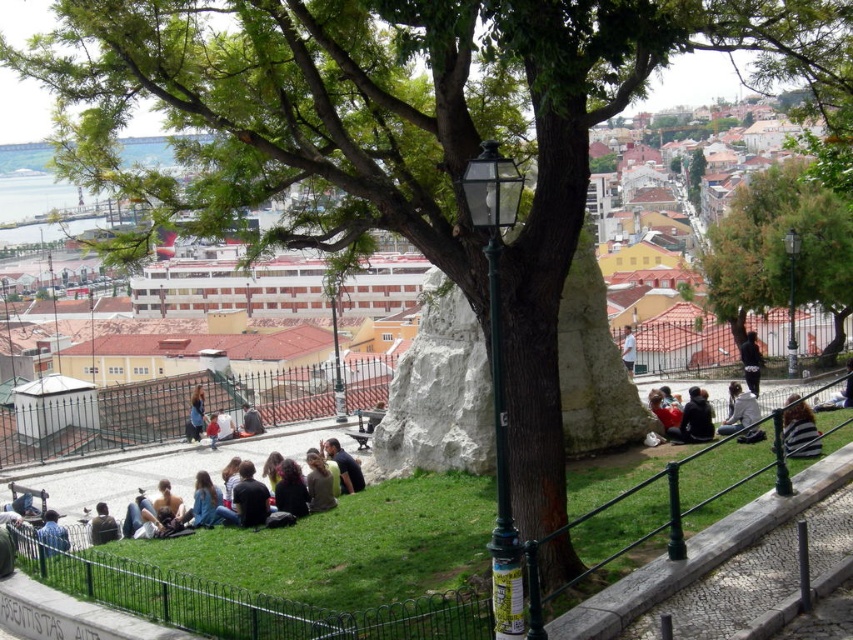
Can you confirm if blue denim jacket at lower center is thinner than red fabric jacket at center?

No, blue denim jacket at lower center is not thinner than red fabric jacket at center.

This screenshot has width=853, height=640. What are the coordinates of `blue denim jacket at lower center` in the screenshot? It's located at (202, 500).

Locate an element on the screen. This screenshot has width=853, height=640. green leafy tree at upper right is located at coordinates (781, 250).

What do you see at coordinates (781, 250) in the screenshot?
I see `green leafy tree at upper right` at bounding box center [781, 250].

The image size is (853, 640). In order to click on green leafy tree at upper right in this screenshot , I will do `click(781, 250)`.

Who is positioned more to the left, dark brown leather jacket at lower center or dark blue jeans at lower left?

dark blue jeans at lower left is more to the left.

Is dark brown leather jacket at lower center in front of dark blue jeans at lower left?

No, dark brown leather jacket at lower center is behind dark blue jeans at lower left.

Locate an element on the screen. The image size is (853, 640). dark brown leather jacket at lower center is located at coordinates (161, 513).